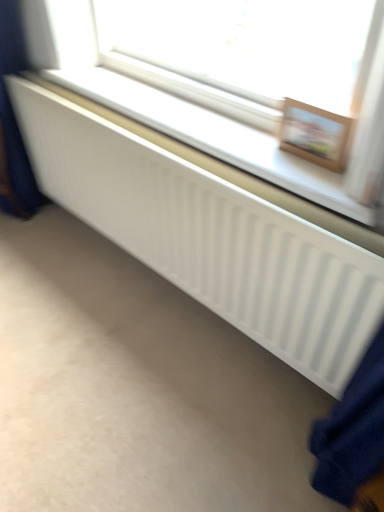
Question: In terms of height, does wooden picture frame at upper right look taller or shorter compared to white matte radiator at center?

Choices:
 (A) short
 (B) tall

Answer: (B)

Question: Would you say wooden picture frame at upper right is to the left or to the right of white matte radiator at center in the picture?

Choices:
 (A) right
 (B) left

Answer: (A)

Question: In terms of size, does wooden picture frame at upper right appear bigger or smaller than white matte radiator at center?

Choices:
 (A) big
 (B) small

Answer: (B)

Question: From the image's perspective, is white matte radiator at center above or below wooden picture frame at upper right?

Choices:
 (A) below
 (B) above

Answer: (B)

Question: Is white matte radiator at center wider or thinner than wooden picture frame at upper right?

Choices:
 (A) wide
 (B) thin

Answer: (A)

Question: From a real-world perspective, is white matte radiator at center physically located above or below wooden picture frame at upper right?

Choices:
 (A) below
 (B) above

Answer: (A)

Question: Is white matte radiator at center in front of or behind wooden picture frame at upper right in the image?

Choices:
 (A) front
 (B) behind

Answer: (A)